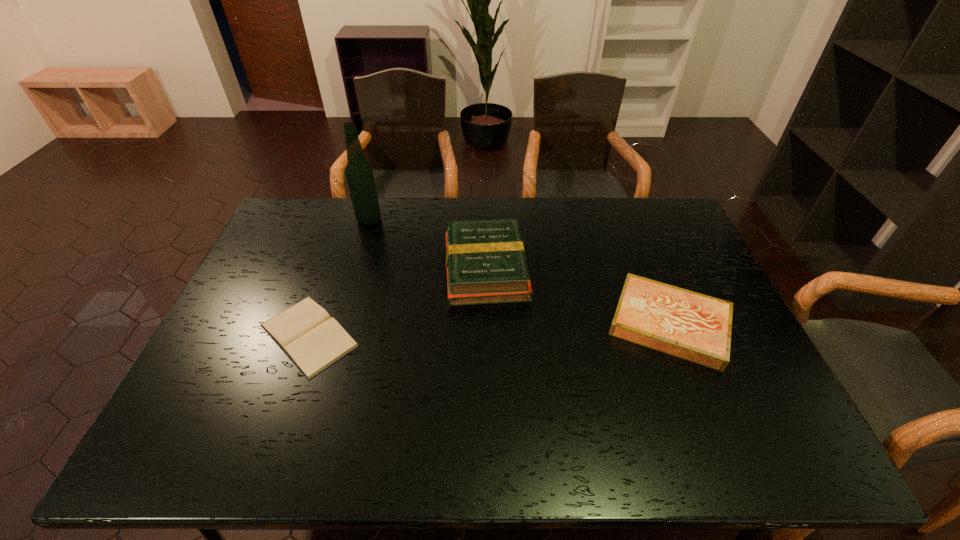
I want to click on the third closest object relative to the shortest object, so click(695, 327).

Identify the location of object that is the third nearest to the shortest object. This screenshot has height=540, width=960. (695, 327).

You are a GUI agent. You are given a task and a screenshot of the screen. Output one action in this format:
    pyautogui.click(x=<x>, y=<y>)
    Task: Click on the vacant area in the image that satisfies the following two spatial constraints: 1. on the front side of the second shortest object; 2. on the left side of the alcohol
    The image size is (960, 540).
    Given the screenshot: What is the action you would take?
    pyautogui.click(x=338, y=324)

The height and width of the screenshot is (540, 960). I want to click on blank area in the image that satisfies the following two spatial constraints: 1. on the front side of the taller hardback book; 2. on the left side of the right hardback book, so click(x=487, y=324).

Find the location of a particular element. vacant area that satisfies the following two spatial constraints: 1. on the back side of the right hardback book; 2. on the right side of the Bible is located at coordinates (313, 324).

Image resolution: width=960 pixels, height=540 pixels. I want to click on free spot that satisfies the following two spatial constraints: 1. on the back side of the left hardback book; 2. on the right side of the shortest object, so click(x=332, y=268).